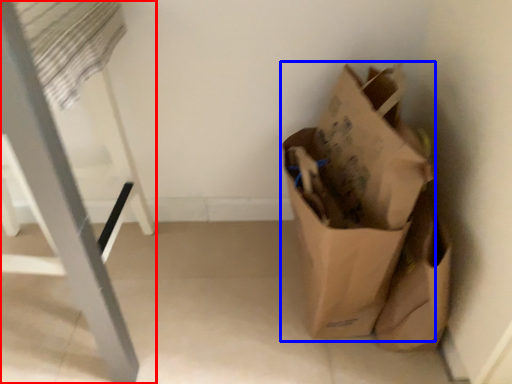
Question: Which point is closer to the camera, furniture (highlighted by a red box) or grocery bag (highlighted by a blue box)?

Choices:
 (A) furniture
 (B) grocery bag

Answer: (A)